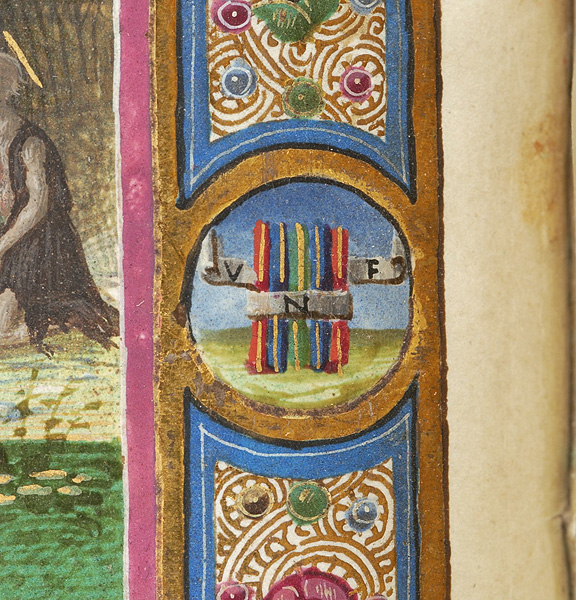
Identify the location of green paint. (68, 509).